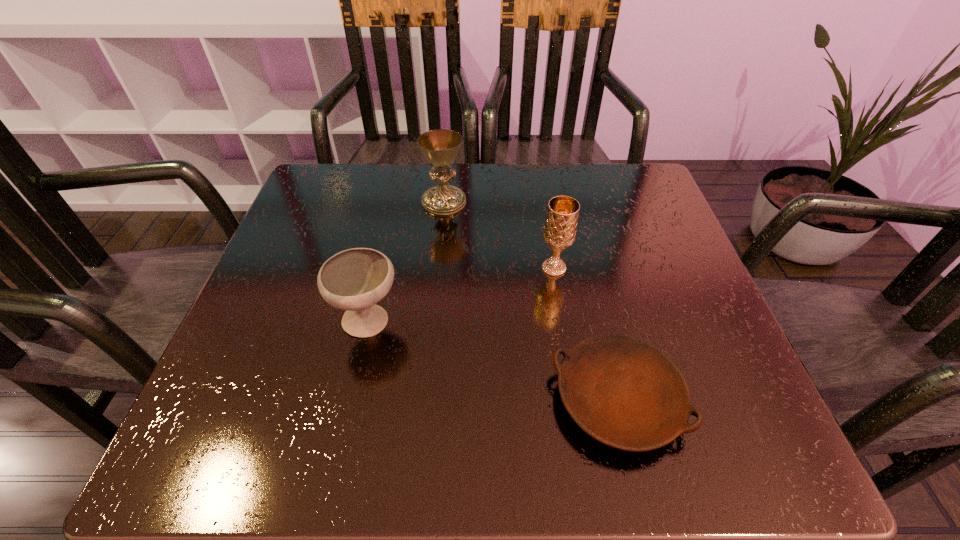
Find the location of `the farthest chalice`. the farthest chalice is located at coordinates (440, 147).

Where is `the farthest object`? the farthest object is located at coordinates point(440,147).

Locate an element on the screen. the third nearest object is located at coordinates (560, 227).

At what (x,y) coordinates should I click in order to perform the action: click on the second nearest chalice. Please return your answer as a coordinate pair (x, y). Image resolution: width=960 pixels, height=540 pixels. Looking at the image, I should click on (560, 227).

Find the location of a particular element. The image size is (960, 540). the leftmost object is located at coordinates (356, 279).

Where is `the nearest chalice`? the nearest chalice is located at coordinates (356, 279).

The image size is (960, 540). I want to click on plate, so click(625, 393).

Locate an element on the screen. vacant space located 0.230m on the left of the second object from left to right is located at coordinates (326, 202).

The image size is (960, 540). What are the coordinates of `free space located 0.160m on the front of the second farthest object` in the screenshot? It's located at (566, 345).

This screenshot has height=540, width=960. What are the coordinates of `free space located 0.130m on the left of the leftmost chalice` in the screenshot? It's located at 264,322.